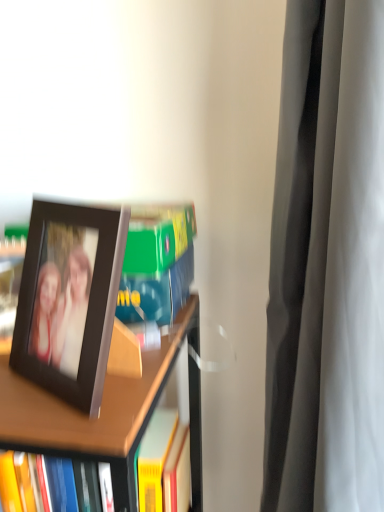
Question: Considering the relative sizes of black plastic picture frame at left and brown wooden bookcase at left in the image provided, is black plastic picture frame at left thinner than brown wooden bookcase at left?

Choices:
 (A) yes
 (B) no

Answer: (A)

Question: Is black plastic picture frame at left closer to the viewer compared to brown wooden bookcase at left?

Choices:
 (A) no
 (B) yes

Answer: (B)

Question: Does black plastic picture frame at left appear on the right side of brown wooden bookcase at left?

Choices:
 (A) yes
 (B) no

Answer: (A)

Question: Does black plastic picture frame at left appear on the left side of brown wooden bookcase at left?

Choices:
 (A) no
 (B) yes

Answer: (A)

Question: Can you confirm if black plastic picture frame at left is wider than brown wooden bookcase at left?

Choices:
 (A) yes
 (B) no

Answer: (B)

Question: Could you tell me if black plastic picture frame at left is facing brown wooden bookcase at left?

Choices:
 (A) yes
 (B) no

Answer: (B)

Question: From a real-world perspective, is brown wooden bookcase at left located beneath black plastic picture frame at left?

Choices:
 (A) yes
 (B) no

Answer: (A)

Question: From a real-world perspective, is brown wooden bookcase at left physically above black plastic picture frame at left?

Choices:
 (A) yes
 (B) no

Answer: (B)

Question: Can you confirm if brown wooden bookcase at left is positioned to the left of black plastic picture frame at left?

Choices:
 (A) no
 (B) yes

Answer: (B)

Question: Considering the relative sizes of brown wooden bookcase at left and black plastic picture frame at left in the image provided, is brown wooden bookcase at left bigger than black plastic picture frame at left?

Choices:
 (A) yes
 (B) no

Answer: (A)

Question: From the image's perspective, does brown wooden bookcase at left appear higher than black plastic picture frame at left?

Choices:
 (A) no
 (B) yes

Answer: (A)

Question: Is brown wooden bookcase at left wider than black plastic picture frame at left?

Choices:
 (A) no
 (B) yes

Answer: (B)

Question: In terms of width, does brown wooden bookcase at left look wider or thinner when compared to black plastic picture frame at left?

Choices:
 (A) wide
 (B) thin

Answer: (A)